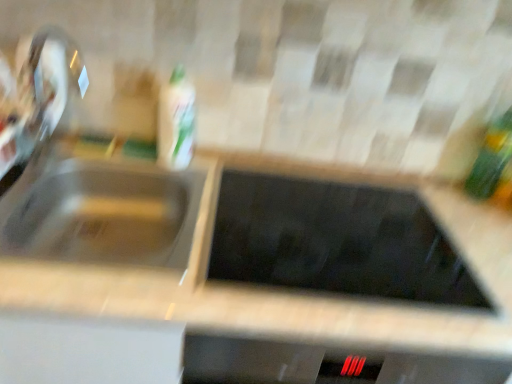
Question: Is satin nickel faucet at left to the left or to the right of satin silver sink at left in the image?

Choices:
 (A) right
 (B) left

Answer: (B)

Question: Relative to satin silver sink at left, is satin nickel faucet at left in front or behind?

Choices:
 (A) behind
 (B) front

Answer: (A)

Question: Estimate the real-world distances between objects in this image. Which object is farther from the satin nickel faucet at left?

Choices:
 (A) white glossy bottle at upper center, which is the 1th bottle in left-to-right order
 (B) satin silver sink at left
 (C) green glass bottle at right, the 2th bottle positioned from the left

Answer: (C)

Question: Estimate the real-world distances between objects in this image. Which object is farther from the satin nickel faucet at left?

Choices:
 (A) white glossy bottle at upper center, marked as the second bottle in a right-to-left arrangement
 (B) green glass bottle at right, the 2th bottle positioned from the left
 (C) satin silver sink at left

Answer: (B)